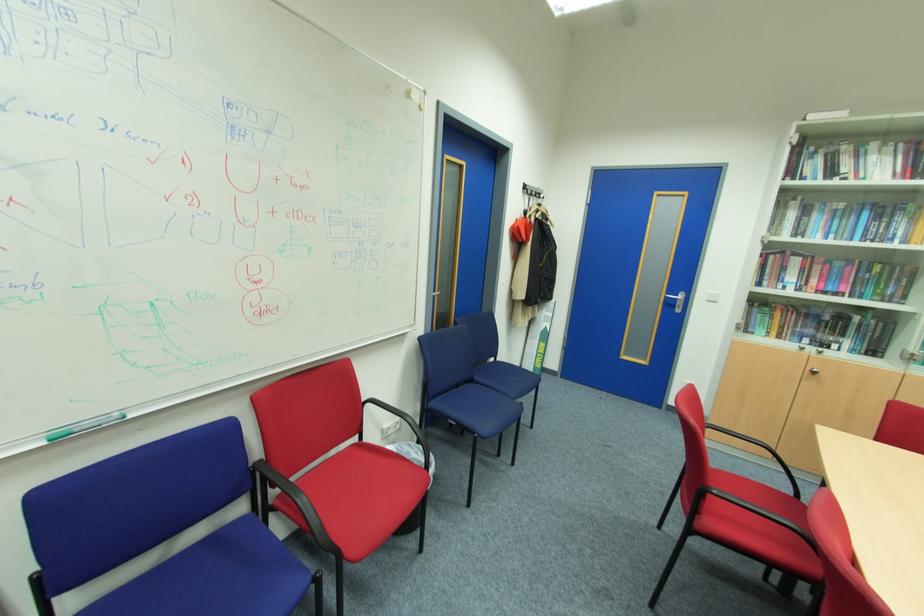
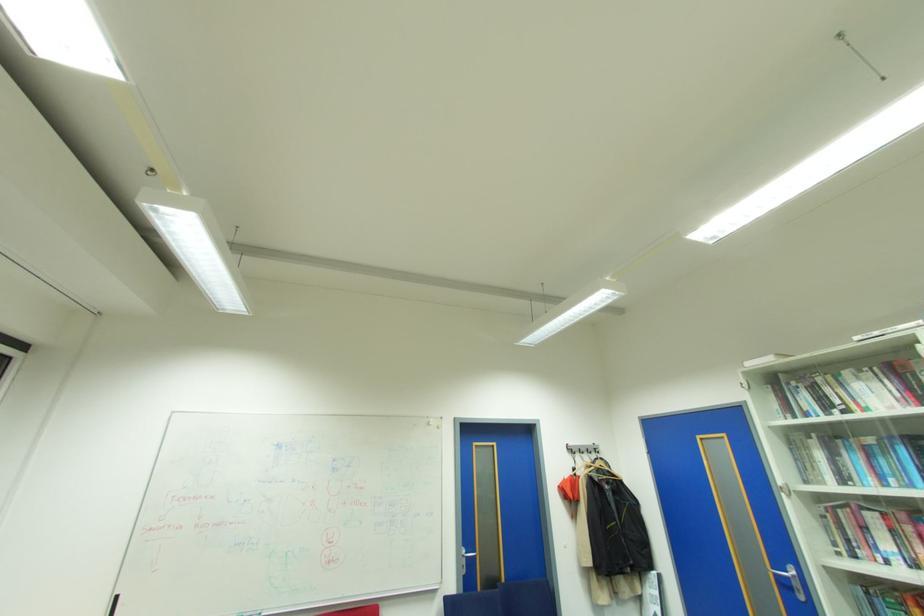
The point at [764,256] is marked in the first image. Where is the corresponding point in the second image?

(832, 512)